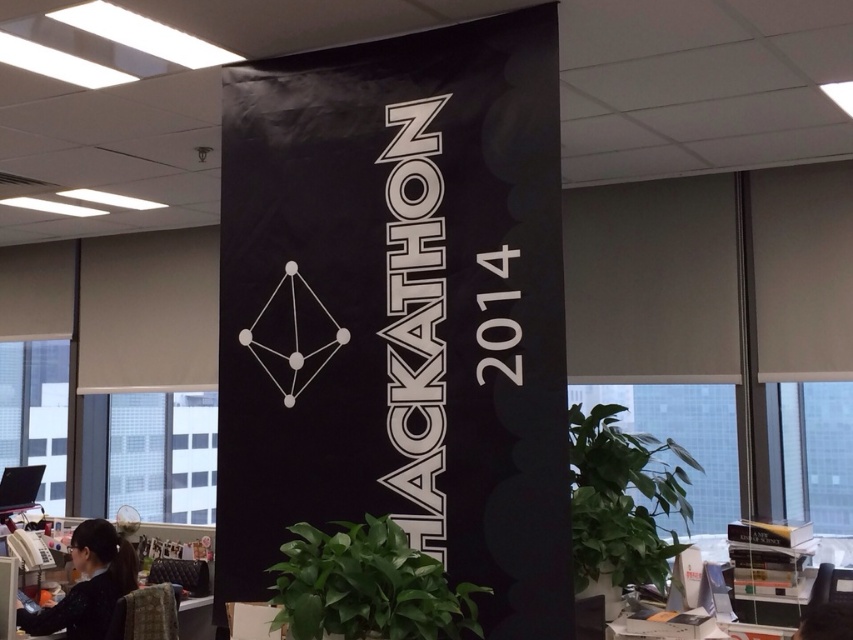
You are an office worker trying to locate your coworker who has black hair. You see the green leafy plant at right and the black hair at lower left. Which object is closer to you?

The green leafy plant at right is in front of black hair at lower left, so it is closer to you.

You are an office worker sitting at your desk and see the green leafy plant at lower center and the black hair at lower left. Which object is positioned higher in the image?

The green leafy plant at lower center is located above the black hair at lower left, so it is positioned higher in the image.